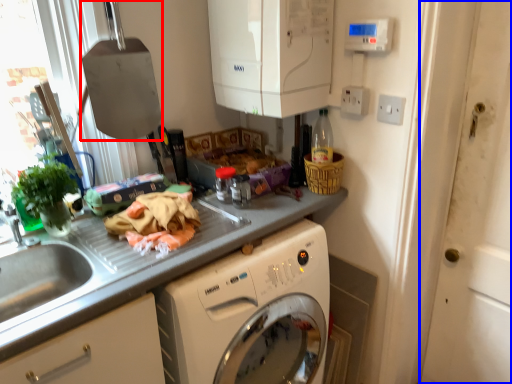
Question: Which of the following is the closest to the observer, appliance (highlighted by a red box) or screen door (highlighted by a blue box)?

Choices:
 (A) appliance
 (B) screen door

Answer: (B)